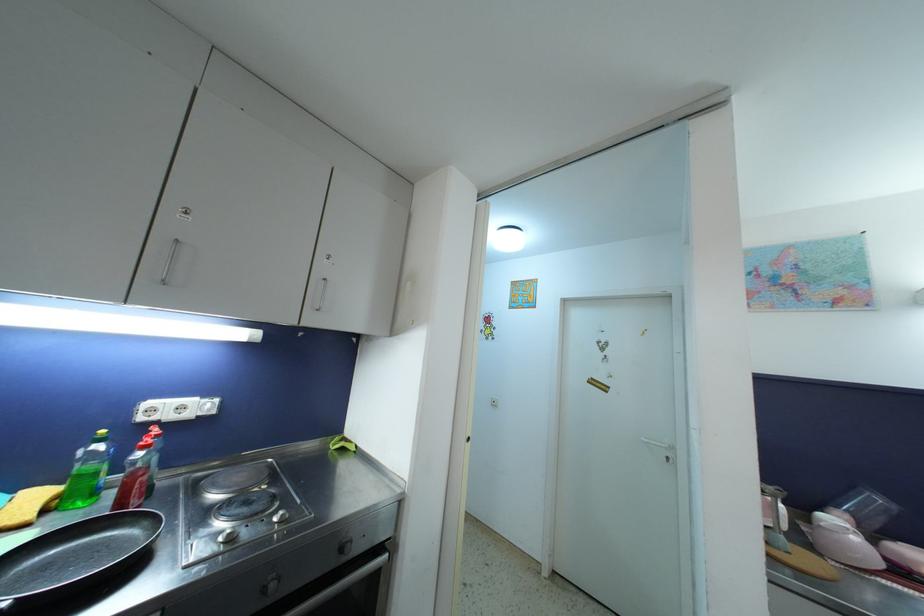
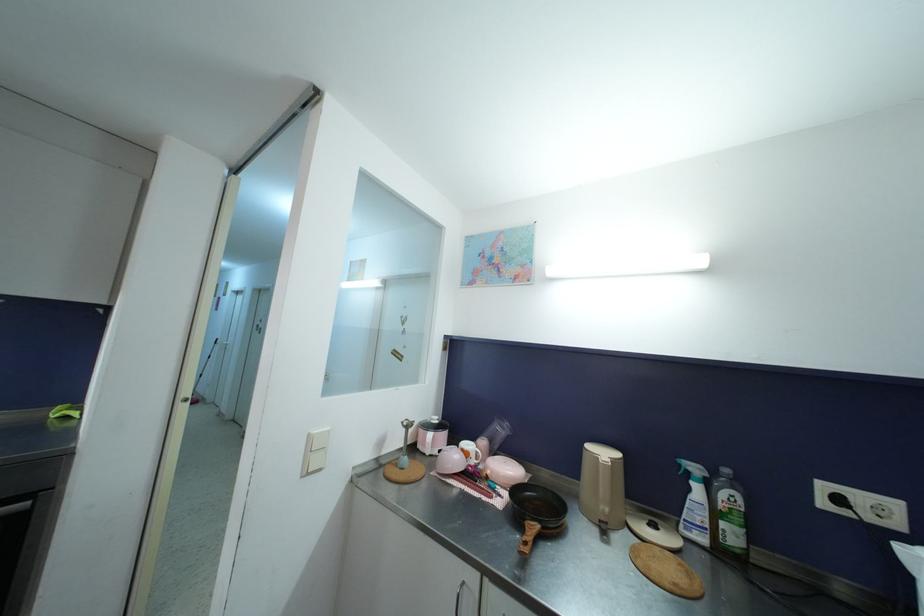
Question: Which direction would the cameraman need to move to produce the second image? Reply with the corresponding letter.

Choices:
 (A) Left
 (B) Right
 (C) Forward
 (D) Backward

Answer: (B)